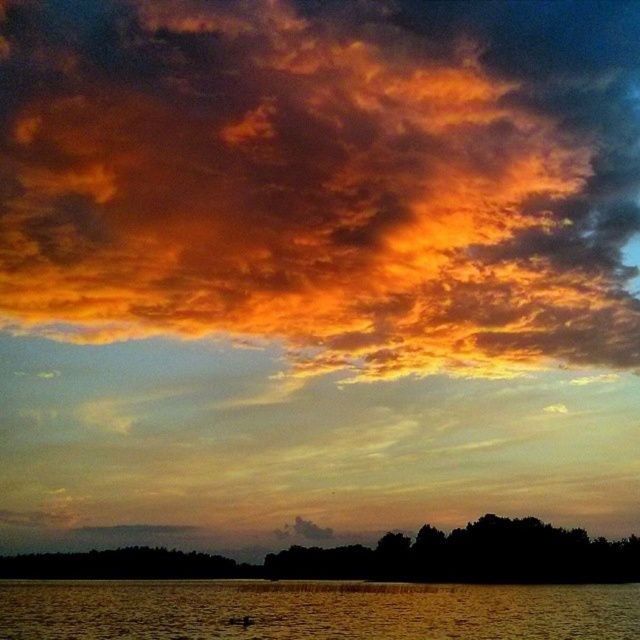
Between fiery cotton clouds at upper center and golden reflective water at lower center, which one has more height?

With more height is fiery cotton clouds at upper center.

Measure the distance from fiery cotton clouds at upper center to golden reflective water at lower center.

They are 141.31 meters apart.

I want to click on fiery cotton clouds at upper center, so tap(324, 177).